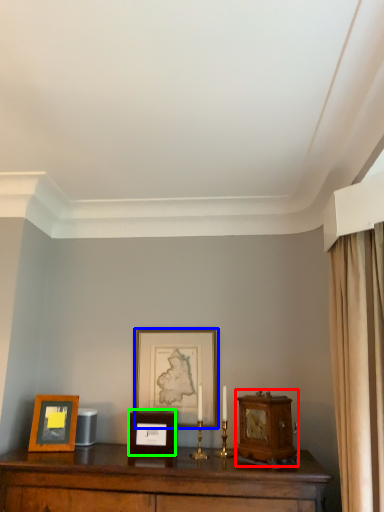
Question: Which object is the closest to the alarm clock (highlighted by a red box)? Choose among these: picture frame (highlighted by a blue box) or picture frame (highlighted by a green box).

Choices:
 (A) picture frame
 (B) picture frame

Answer: (B)